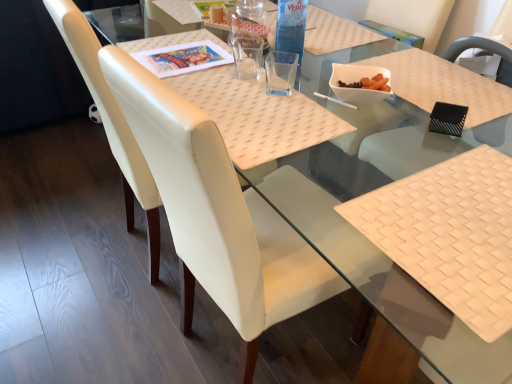
This screenshot has width=512, height=384. I want to click on empty space that is ontop of white woven placemat at lower right (from a real-world perspective), so (462, 216).